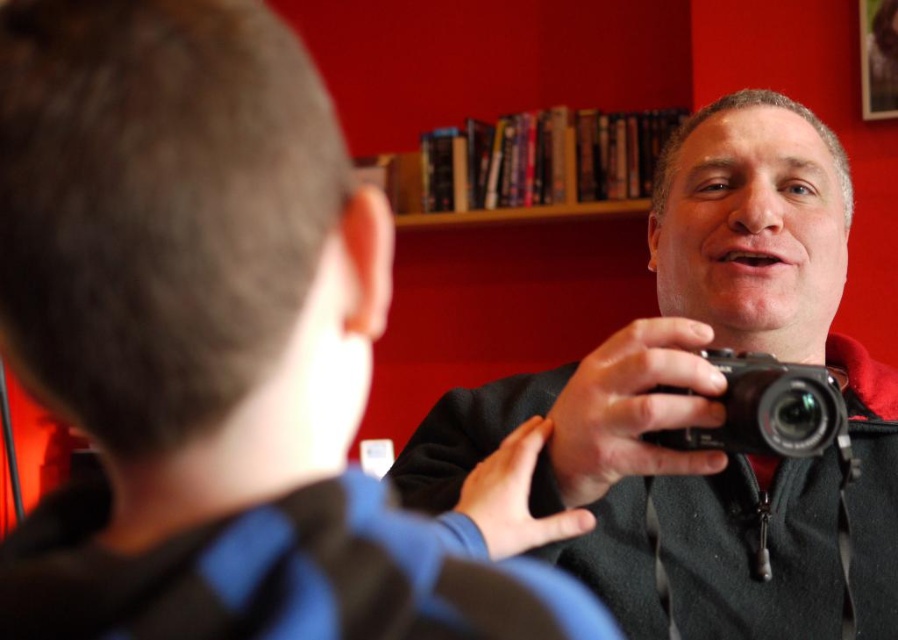
You are a photographer trying to capture a portrait of the smooth blue shirt at center and the black matte camera at center. Which object should you focus on first if you want to ensure both are in sharp focus, considering their heights?

The smooth blue shirt at center has a lesser height compared to black matte camera at center. To ensure both are in sharp focus, you should focus on the black matte camera at center first as it is taller and requires more depth of field.

You are standing in the room and want to hand a book to the person wearing the smooth blue shirt at center. Based on their position in the scene, which direction should you walk to reach them?

The smooth blue shirt at center is located at point [223,353], so you should walk towards the center of the room to reach them.